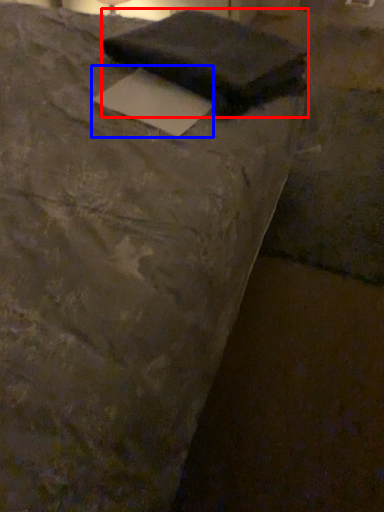
Question: Which object appears farthest to the camera in this image, writing (highlighted by a red box) or writing (highlighted by a blue box)?

Choices:
 (A) writing
 (B) writing

Answer: (A)